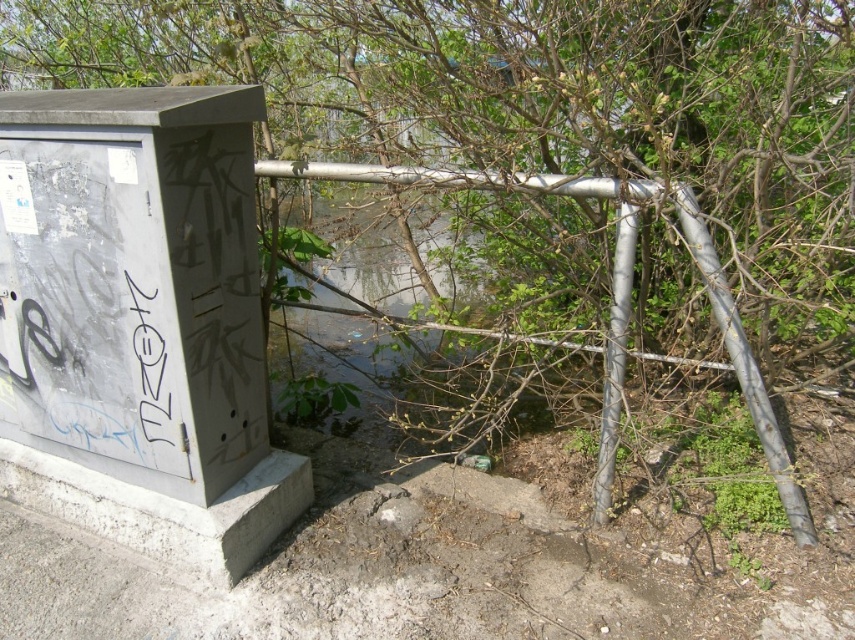
Is metallic gray pole at right positioned before black graffiti at left?

No, metallic gray pole at right is further to the viewer.

Who is taller, metallic gray pole at right or black graffiti at left?

metallic gray pole at right

Is point (677, 202) positioned in front of point (151, 352)?

Yes, it is in front of point (151, 352).

Locate an element on the screen. metallic gray pole at right is located at coordinates (744, 365).

Looking at this image, between metallic silver rail at center and silver metallic pole at center-right, which one has less height?

silver metallic pole at center-right

Who is positioned more to the left, metallic silver rail at center or silver metallic pole at center-right?

metallic silver rail at center

Who is more distant from viewer, (x=682, y=228) or (x=609, y=412)?

The point (x=609, y=412) is more distant.

Identify the location of metallic silver rail at center. (743, 364).

This screenshot has width=855, height=640. What do you see at coordinates (744, 365) in the screenshot? I see `metallic gray pole at right` at bounding box center [744, 365].

Consider the image. Who is more forward, (805, 524) or (628, 208)?

Point (628, 208) is more forward.

You are a GUI agent. You are given a task and a screenshot of the screen. Output one action in this format:
    pyautogui.click(x=<x>, y=<y>)
    Task: Click on the metallic gray pole at right
    Image resolution: width=855 pixels, height=640 pixels.
    Given the screenshot: What is the action you would take?
    pyautogui.click(x=744, y=365)